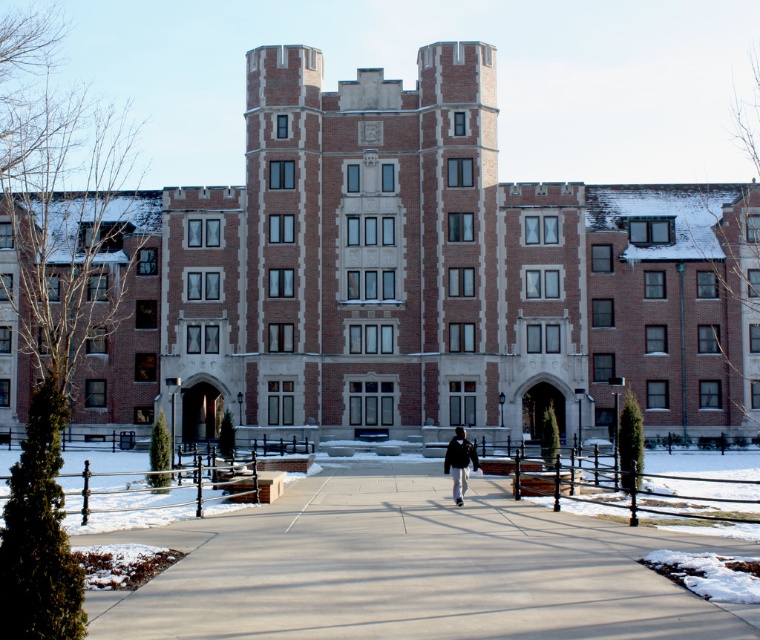
Question: Which point is closer to the camera taking this photo?

Choices:
 (A) (396, 561)
 (B) (458, 467)

Answer: (A)

Question: Can you confirm if concrete at center is bigger than black matte jacket at center?

Choices:
 (A) no
 (B) yes

Answer: (B)

Question: Can you confirm if concrete at center is wider than black matte jacket at center?

Choices:
 (A) yes
 (B) no

Answer: (A)

Question: Is the position of concrete at center more distant than that of black matte jacket at center?

Choices:
 (A) no
 (B) yes

Answer: (A)